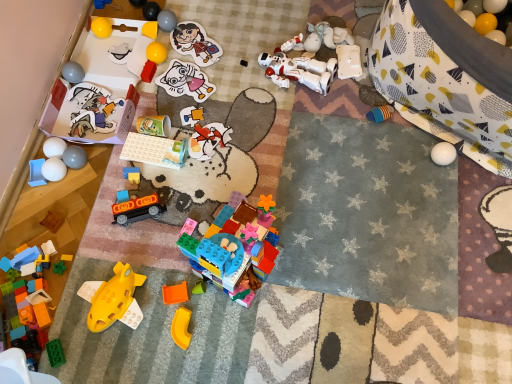
Question: Is white matte balls at left, marked as the 4th toy in a left-to-right arrangement, spatially inside matte gray ball at upper center, which is the 18th toy in left-to-right order, or outside of it?

Choices:
 (A) outside
 (B) inside

Answer: (A)

Question: Does point (47, 178) appear closer or farther from the camera than point (162, 13)?

Choices:
 (A) farther
 (B) closer

Answer: (B)

Question: Based on their relative distances, which object is farther from the translucent blue plastic blocks at lower left, acting as the 24th toy starting from the right?

Choices:
 (A) matte blue plastic toy at center, acting as the thirteenth toy starting from the left
 (B) matte gray ball at upper left, which ranks as the fifth toy in left-to-right order
 (C) white matte balls at left, placed as the 22th toy when sorted from right to left
 (D) matte plastic cup at center, which is counted as the tenth toy, starting from the right
 (E) orange matte train at center, which is the twelfth toy in right-to-left order

Answer: (B)

Question: Which object is positioned closest to the rubber yellow ball at upper left, acting as the 16th toy starting from the right?

Choices:
 (A) matte paper sticker at upper center, which is counted as the twentieth toy, starting from the left
 (B) blue plastic blocks at upper left, the nineteenth toy from the right
 (C) translucent green plastic toy at lower left, which is the 8th toy in left-to-right order
 (D) yellow rubber ball at upper left, positioned as the 11th toy in right-to-left order
 (E) matte plastic cup at center, positioned as the sixteenth toy in left-to-right order

Answer: (B)